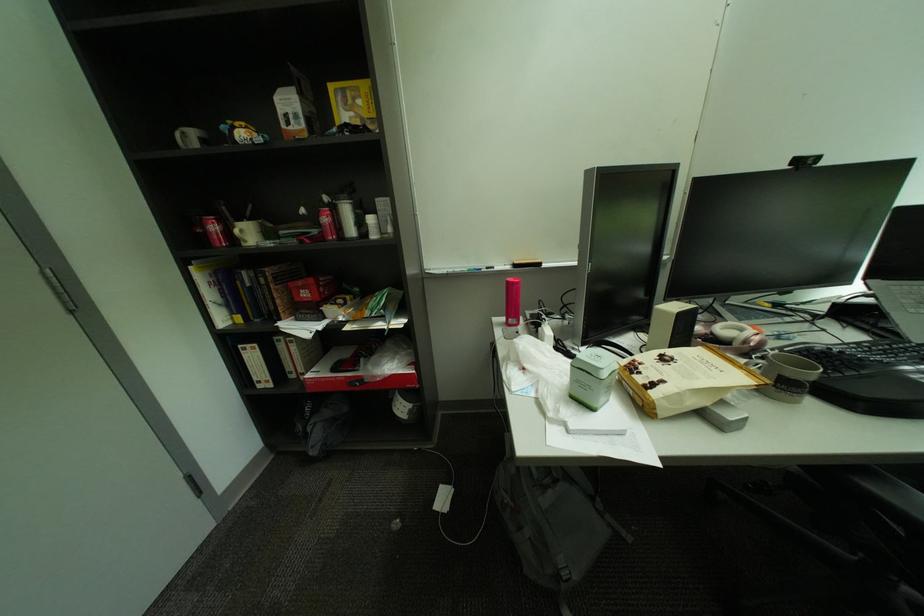
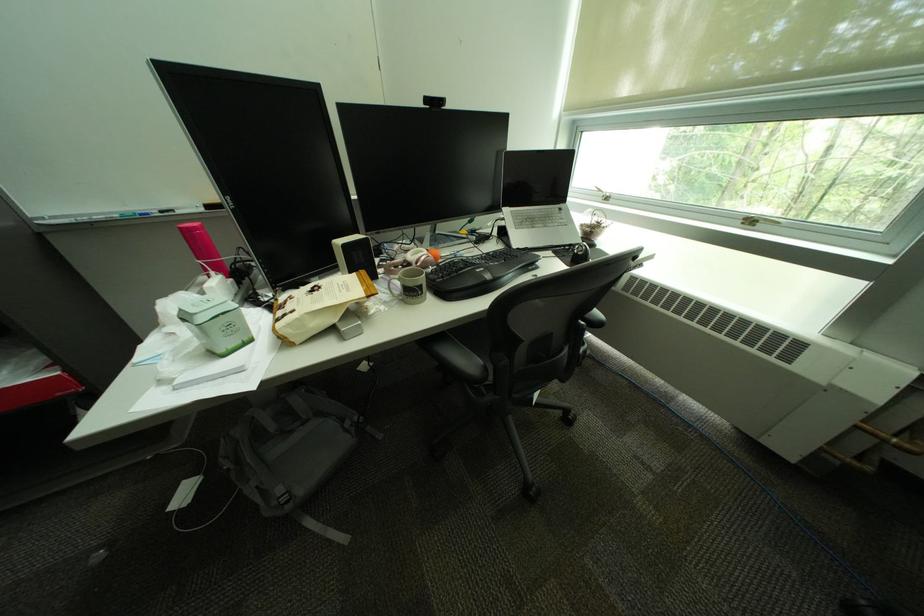
In the second image, find the point that corresponds to (x=881, y=294) in the first image.

(514, 217)